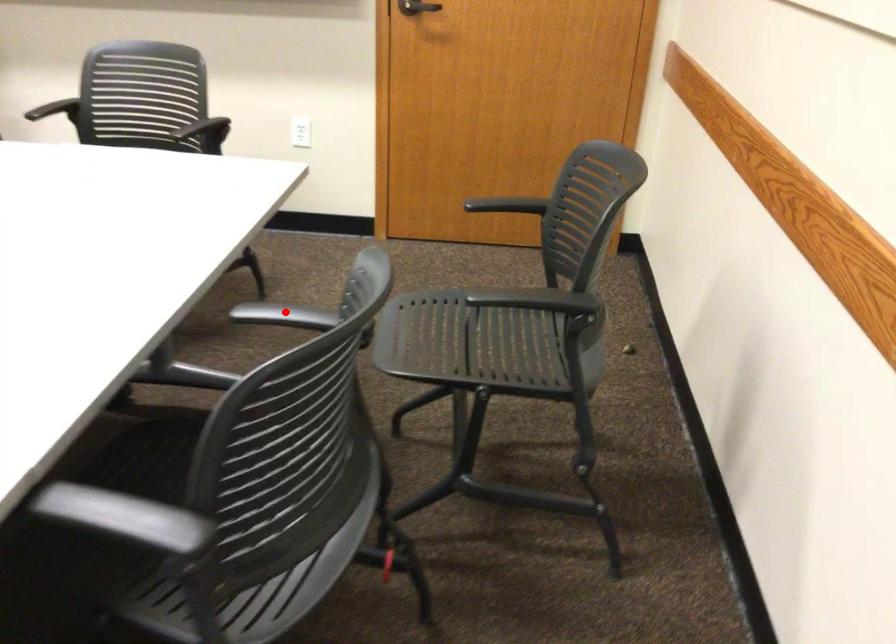
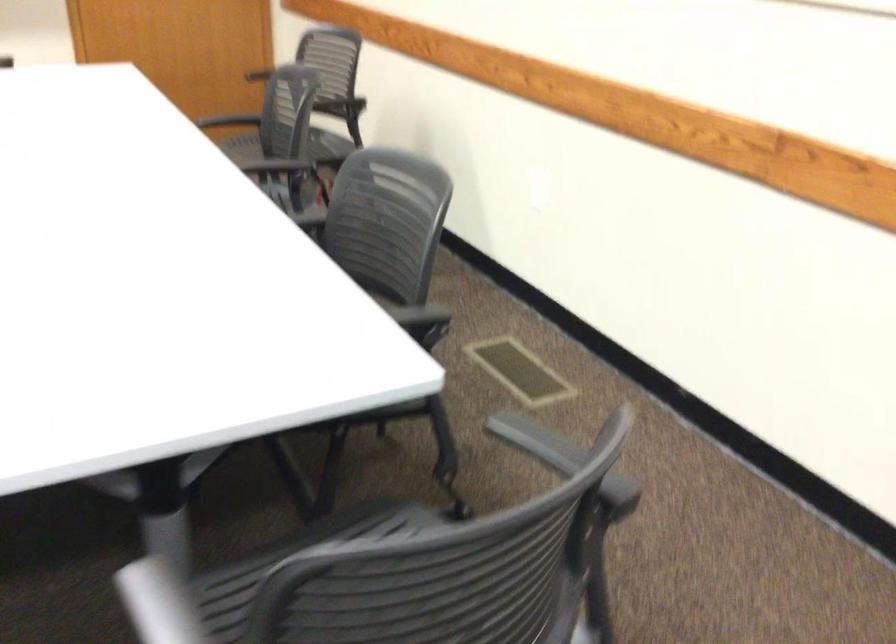
Question: I am providing you with two images of the same scene from different viewpoints. A red point is shown in image1. For the corresponding object point in image2, is it positioned nearer or farther from the camera?

Choices:
 (A) Nearer
 (B) Farther

Answer: (B)